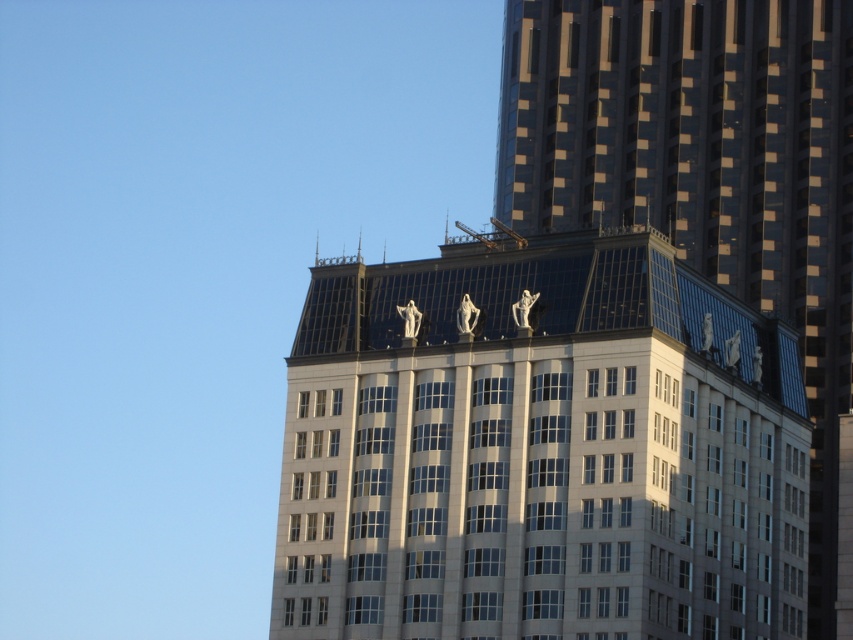
Does white marble statues at upper center appear over reflective glass skyscraper at upper center?

No, white marble statues at upper center is not above reflective glass skyscraper at upper center.

Who is taller, white marble statues at upper center or reflective glass skyscraper at upper center?

With more height is reflective glass skyscraper at upper center.

In the scene shown: Who is more distant from viewer, (296, 346) or (828, 600)?

The point (828, 600) is more distant.

Locate an element on the screen. This screenshot has width=853, height=640. white marble statues at upper center is located at coordinates (538, 449).